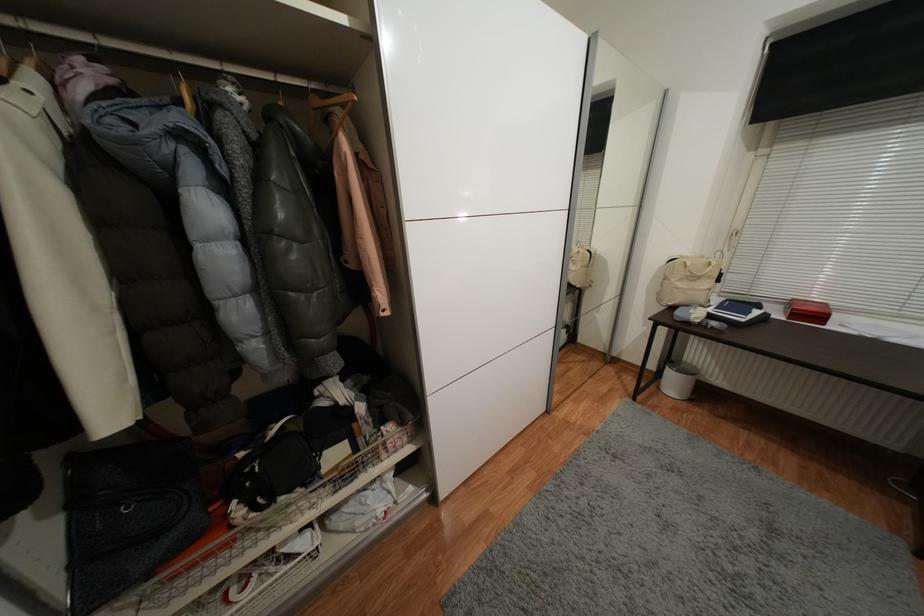
Where would you hang the wooden clothes hanger? Please return your answer as a coordinate pair (x, y).

(184, 87)